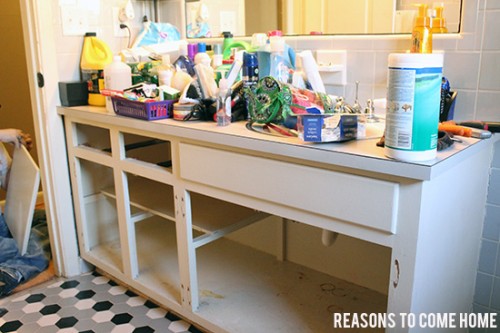
This screenshot has height=333, width=500. I want to click on alcohol bottle, so click(x=121, y=73).